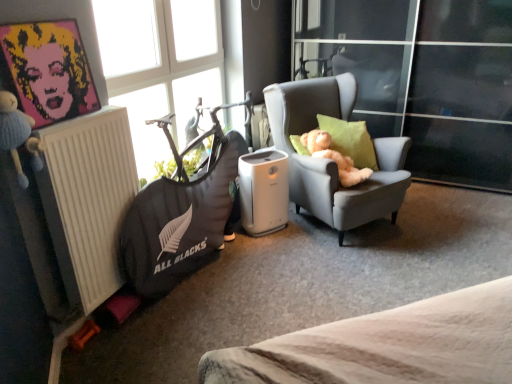
Question: Can we say white matte radiator at left lies outside transparent glass window at upper left?

Choices:
 (A) no
 (B) yes

Answer: (B)

Question: Is white matte radiator at left oriented towards transparent glass window at upper left?

Choices:
 (A) no
 (B) yes

Answer: (A)

Question: From a real-world perspective, does white matte radiator at left sit lower than transparent glass window at upper left?

Choices:
 (A) yes
 (B) no

Answer: (A)

Question: From the image's perspective, is white matte radiator at left under transparent glass window at upper left?

Choices:
 (A) yes
 (B) no

Answer: (A)

Question: Is transparent glass window at upper left inside white matte radiator at left?

Choices:
 (A) no
 (B) yes

Answer: (A)

Question: Do you think gray fabric armchair at center is within white matte radiator at left, or outside of it?

Choices:
 (A) inside
 (B) outside

Answer: (B)

Question: Looking at their shapes, would you say gray fabric armchair at center is wider or thinner than white matte radiator at left?

Choices:
 (A) wide
 (B) thin

Answer: (A)

Question: Looking at the image, does gray fabric armchair at center seem bigger or smaller compared to white matte radiator at left?

Choices:
 (A) big
 (B) small

Answer: (A)

Question: Considering the positions of gray fabric armchair at center and white matte radiator at left in the image, is gray fabric armchair at center taller or shorter than white matte radiator at left?

Choices:
 (A) tall
 (B) short

Answer: (A)

Question: In terms of width, does green fabric pillow at right look wider or thinner when compared to white matte radiator at left?

Choices:
 (A) thin
 (B) wide

Answer: (B)

Question: Considering the positions of point (347, 135) and point (81, 283), is point (347, 135) closer or farther from the camera than point (81, 283)?

Choices:
 (A) closer
 (B) farther

Answer: (B)

Question: Considering the positions of green fabric pillow at right and white matte radiator at left in the image, is green fabric pillow at right taller or shorter than white matte radiator at left?

Choices:
 (A) tall
 (B) short

Answer: (B)

Question: Relative to white matte radiator at left, is green fabric pillow at right in front or behind?

Choices:
 (A) front
 (B) behind

Answer: (B)

Question: Considering their positions, is dark gray fabric bean bag at left located in front of or behind green fabric pillow at right?

Choices:
 (A) behind
 (B) front

Answer: (B)

Question: Considering the positions of dark gray fabric bean bag at left and green fabric pillow at right in the image, is dark gray fabric bean bag at left taller or shorter than green fabric pillow at right?

Choices:
 (A) tall
 (B) short

Answer: (A)